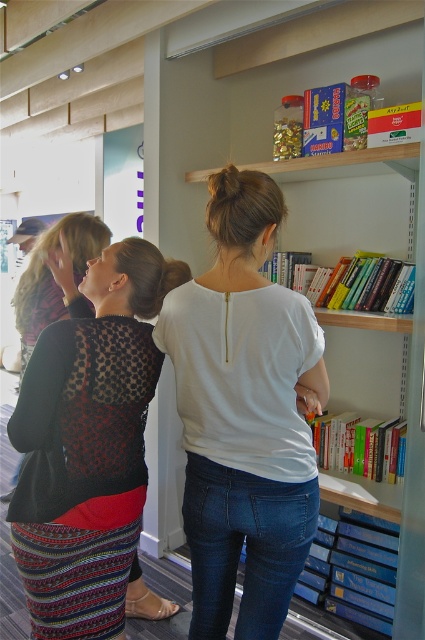
Question: Which object appears closest to the camera in this image?

Choices:
 (A) black lace top at left
 (B) patterned fabric dress at left
 (C) white matte shirt at center

Answer: (C)

Question: Does black lace top at left have a larger size compared to patterned fabric dress at left?

Choices:
 (A) yes
 (B) no

Answer: (B)

Question: From the image, what is the correct spatial relationship of white matte shirt at center in relation to patterned fabric dress at left?

Choices:
 (A) left
 (B) right

Answer: (B)

Question: Which object is farther from the camera taking this photo?

Choices:
 (A) white matte shirt at center
 (B) patterned fabric dress at left
 (C) black lace top at left

Answer: (B)

Question: Which object is the farthest from the white matte shirt at center?

Choices:
 (A) patterned fabric dress at left
 (B) black lace top at left

Answer: (A)

Question: Can you confirm if white matte shirt at center is bigger than patterned fabric dress at left?

Choices:
 (A) yes
 (B) no

Answer: (A)